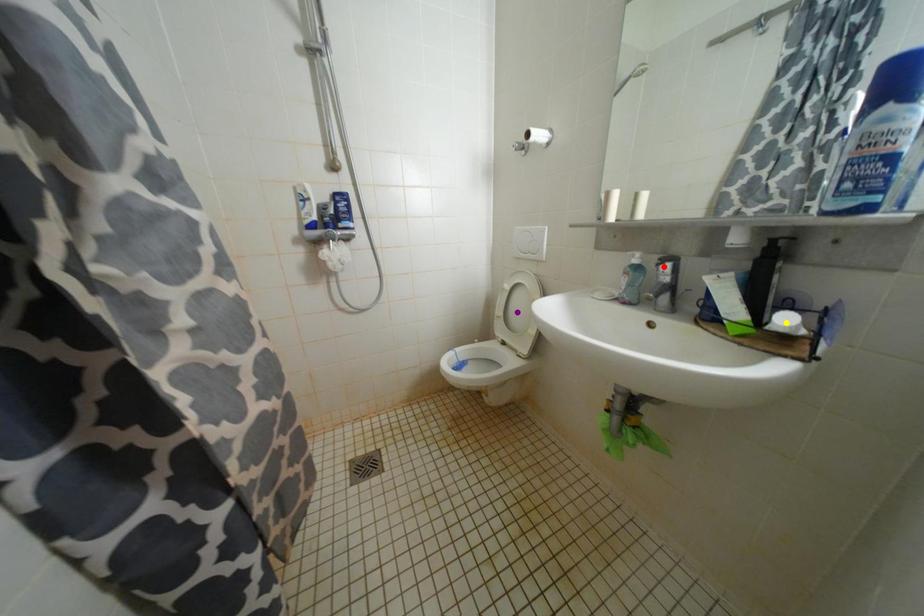
From the picture: Order these from nearest to farthest:
1. red point
2. yellow point
3. purple point

purple point
red point
yellow point